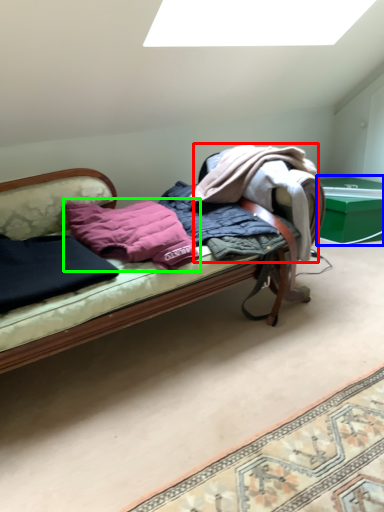
Question: Which object is positioned closest to clothing (highlighted by a red box)? Select from table (highlighted by a blue box) and pillow (highlighted by a green box).

Choices:
 (A) table
 (B) pillow

Answer: (B)